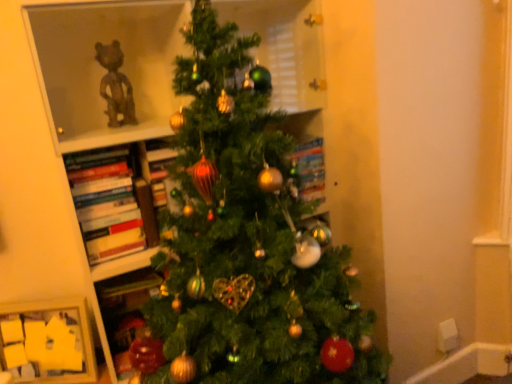
Question: Considering the positions of wooden picture frame at lower left and hardcover books at left in the image, is wooden picture frame at lower left taller or shorter than hardcover books at left?

Choices:
 (A) tall
 (B) short

Answer: (B)

Question: Visually, is wooden picture frame at lower left positioned to the left or to the right of hardcover books at left?

Choices:
 (A) left
 (B) right

Answer: (A)

Question: Which object is positioned closest to the green matte christmas tree at center?

Choices:
 (A) wooden picture frame at lower left
 (B) hardcover books at left

Answer: (B)

Question: Estimate the real-world distances between objects in this image. Which object is closer to the wooden picture frame at lower left?

Choices:
 (A) green matte christmas tree at center
 (B) hardcover books at left

Answer: (B)